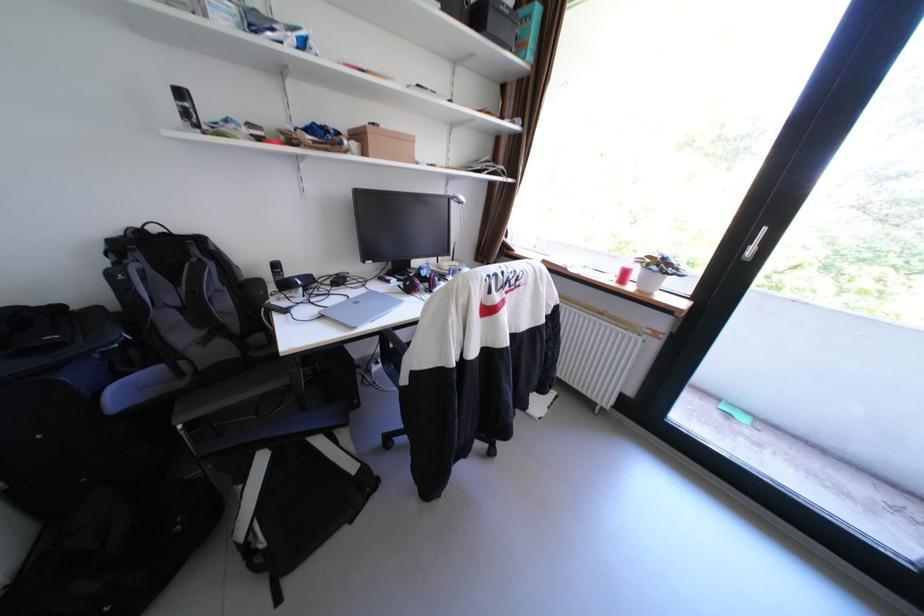
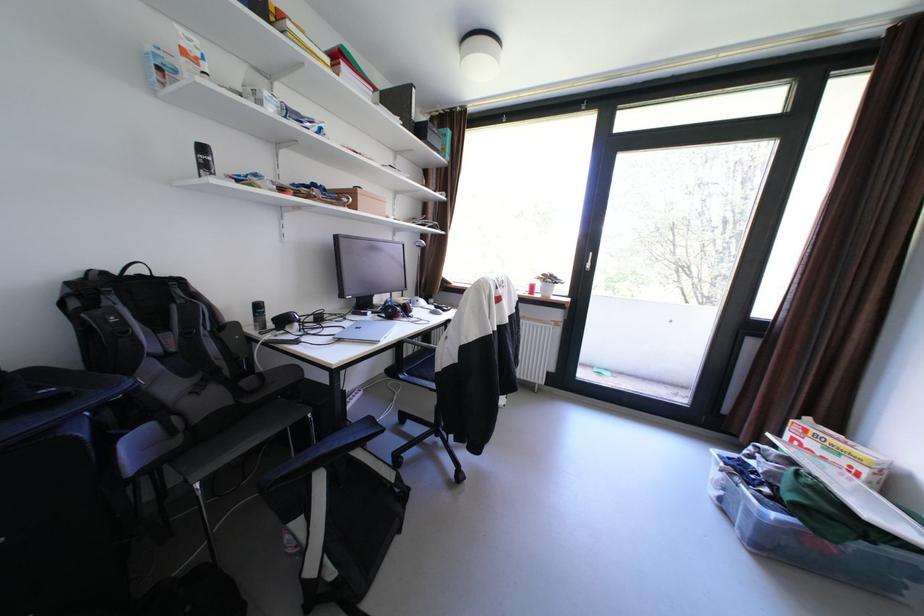
Where in the second image is the point corresponding to (x=381, y=138) from the first image?

(370, 197)